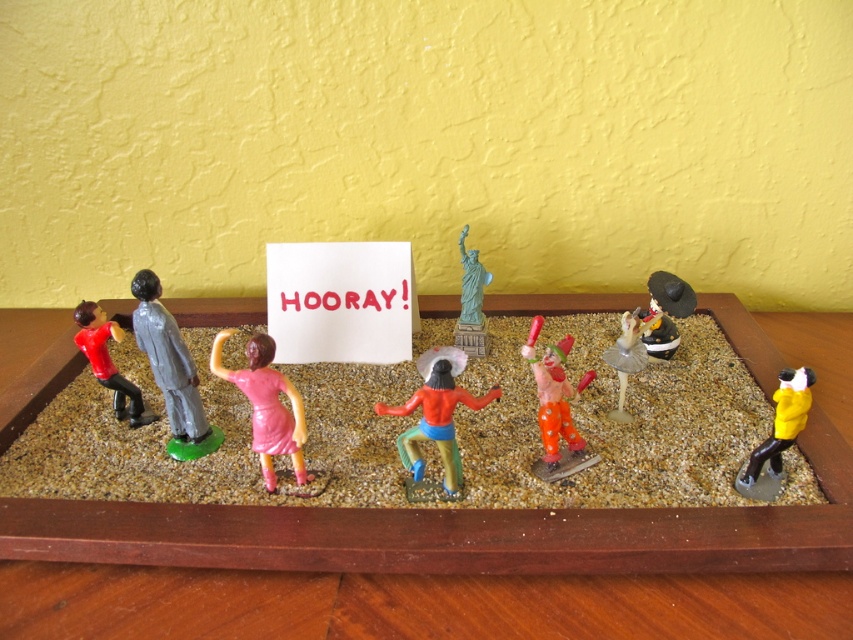
You are a visitor observing the miniature diorama. You notice the yellow matte figure at lower right and the red shirt and black pants figurine on the left. Based on their positions, which figurine is closer to the edge of the wooden frame?

The yellow matte figure at lower right is closer to the edge of the wooden frame because it is located at point [778,432], which is near the lower right corner.